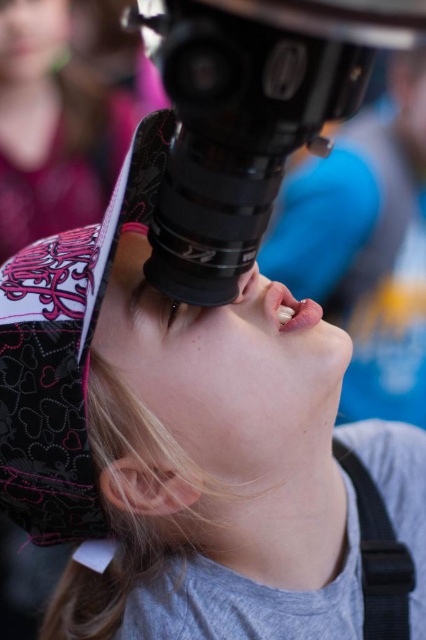
Question: Can you confirm if black matte telescope at center is positioned below matte black eye at center?

Choices:
 (A) no
 (B) yes

Answer: (A)

Question: Is black matte telescope at center positioned before matte black eye at center?

Choices:
 (A) yes
 (B) no

Answer: (A)

Question: Does black matte telescope at center appear under matte black eye at center?

Choices:
 (A) no
 (B) yes

Answer: (A)

Question: Which object is farther from the camera taking this photo?

Choices:
 (A) matte black eye at center
 (B) black matte telescope at center

Answer: (A)

Question: Which point is farther from the camera taking this photo?

Choices:
 (A) (209, 202)
 (B) (169, 321)

Answer: (B)